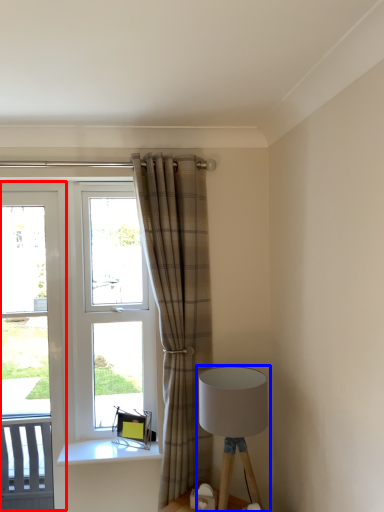
Question: Which of the following is the closest to the observer, screen door (highlighted by a red box) or lamp (highlighted by a blue box)?

Choices:
 (A) screen door
 (B) lamp

Answer: (B)